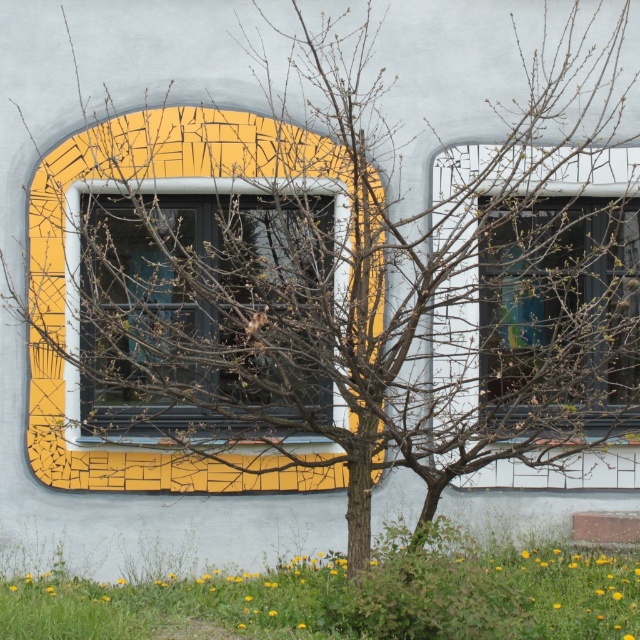
Question: Which of the following is the farthest from the observer?

Choices:
 (A) matte glass window at center
 (B) yellow mosaic tile at center

Answer: (B)

Question: Which of these objects is positioned closest to the yellow mosaic tile at center?

Choices:
 (A) transparent glass window at center
 (B) matte glass window at center

Answer: (B)

Question: Does yellow mosaic tile at center appear on the left side of transparent glass window at center?

Choices:
 (A) no
 (B) yes

Answer: (B)

Question: In this image, where is yellow mosaic tile at center located relative to matte glass window at center?

Choices:
 (A) below
 (B) above

Answer: (A)

Question: Is yellow mosaic tile at center below matte glass window at center?

Choices:
 (A) yes
 (B) no

Answer: (A)

Question: Estimate the real-world distances between objects in this image. Which object is farther from the matte glass window at center?

Choices:
 (A) transparent glass window at center
 (B) yellow mosaic tile at center

Answer: (A)